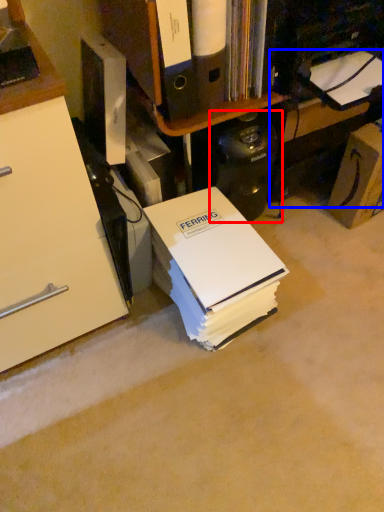
Question: Among these objects, which one is farthest to the camera, computer tower (highlighted by a red box) or computer desk (highlighted by a blue box)?

Choices:
 (A) computer tower
 (B) computer desk

Answer: (B)